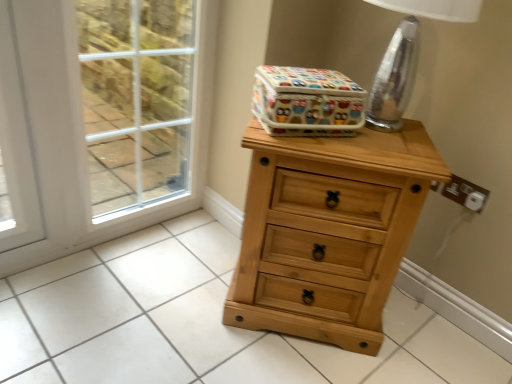
Question: Does transparent glass screen door at left appear on the right side of colorful fabric storage box at upper center?

Choices:
 (A) yes
 (B) no

Answer: (B)

Question: Does transparent glass screen door at left lie behind colorful fabric storage box at upper center?

Choices:
 (A) no
 (B) yes

Answer: (B)

Question: Does transparent glass screen door at left have a lesser width compared to colorful fabric storage box at upper center?

Choices:
 (A) yes
 (B) no

Answer: (A)

Question: Can you confirm if transparent glass screen door at left is positioned to the left of colorful fabric storage box at upper center?

Choices:
 (A) yes
 (B) no

Answer: (A)

Question: Is there a large distance between transparent glass screen door at left and colorful fabric storage box at upper center?

Choices:
 (A) yes
 (B) no

Answer: (B)

Question: From the image's perspective, is transparent glass screen door at left beneath colorful fabric storage box at upper center?

Choices:
 (A) yes
 (B) no

Answer: (A)

Question: From the image's perspective, is clear glass table lamp at upper right on top of white plastic electric outlet at right?

Choices:
 (A) yes
 (B) no

Answer: (A)

Question: From a real-world perspective, is clear glass table lamp at upper right located higher than white plastic electric outlet at right?

Choices:
 (A) no
 (B) yes

Answer: (B)

Question: Does clear glass table lamp at upper right appear on the left side of white plastic electric outlet at right?

Choices:
 (A) yes
 (B) no

Answer: (A)

Question: Does clear glass table lamp at upper right lie in front of white plastic electric outlet at right?

Choices:
 (A) yes
 (B) no

Answer: (A)

Question: Is clear glass table lamp at upper right located outside white plastic electric outlet at right?

Choices:
 (A) no
 (B) yes

Answer: (B)

Question: Is white plastic electric outlet at right inside clear glass table lamp at upper right?

Choices:
 (A) yes
 (B) no

Answer: (B)

Question: Does white plastic electric outlet at right come in front of clear glass table lamp at upper right?

Choices:
 (A) yes
 (B) no

Answer: (B)